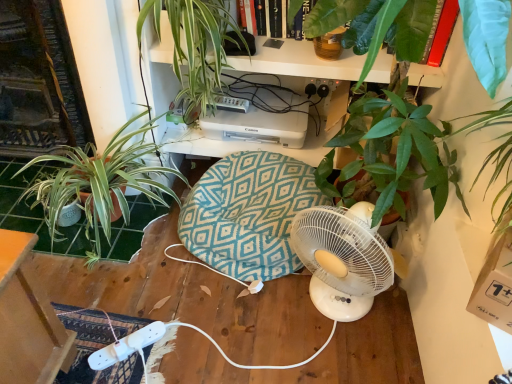
Question: Looking at the image, does green leafy plant at left, the 2th houseplant viewed from the right, seem bigger or smaller compared to green leafy plant at upper center, the 1th houseplant from the right?

Choices:
 (A) small
 (B) big

Answer: (B)

Question: From a real-world perspective, is green leafy plant at left, the first houseplant when ordered from left to right, positioned above or below green leafy plant at upper center, the 1th houseplant from the right?

Choices:
 (A) below
 (B) above

Answer: (A)

Question: Estimate the real-world distances between objects in this image. Which object is closer to the green leafy plant at upper center, the 2th houseplant from the left?

Choices:
 (A) black plastic plug at upper center
 (B) green leafy plant at left, the 2th houseplant viewed from the right
 (C) teal fabric swivel chair at center

Answer: (B)

Question: Which is nearer to the black plastic plug at upper center?

Choices:
 (A) teal fabric swivel chair at center
 (B) green leafy plant at upper center, the 2th houseplant from the left
 (C) green leafy plant at left, the 2th houseplant viewed from the right

Answer: (B)